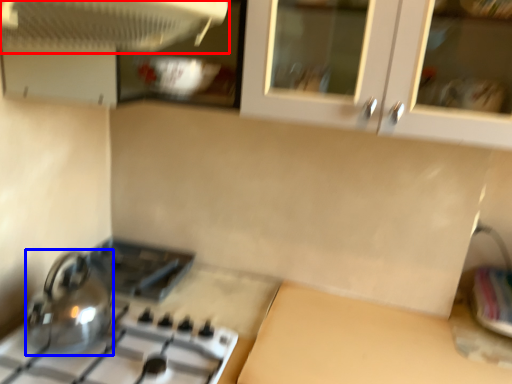
Question: Which of the following is the closest to the observer, kitchen appliance (highlighted by a red box) or kitchen appliance (highlighted by a blue box)?

Choices:
 (A) kitchen appliance
 (B) kitchen appliance

Answer: (A)